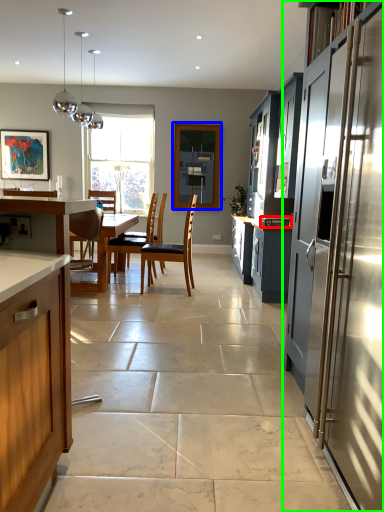
Question: Estimate the real-world distances between objects in this image. Which object is closer to appliance (highlighted by a red box), window screen (highlighted by a blue box) or cabinetry (highlighted by a green box)?

Choices:
 (A) window screen
 (B) cabinetry

Answer: (B)